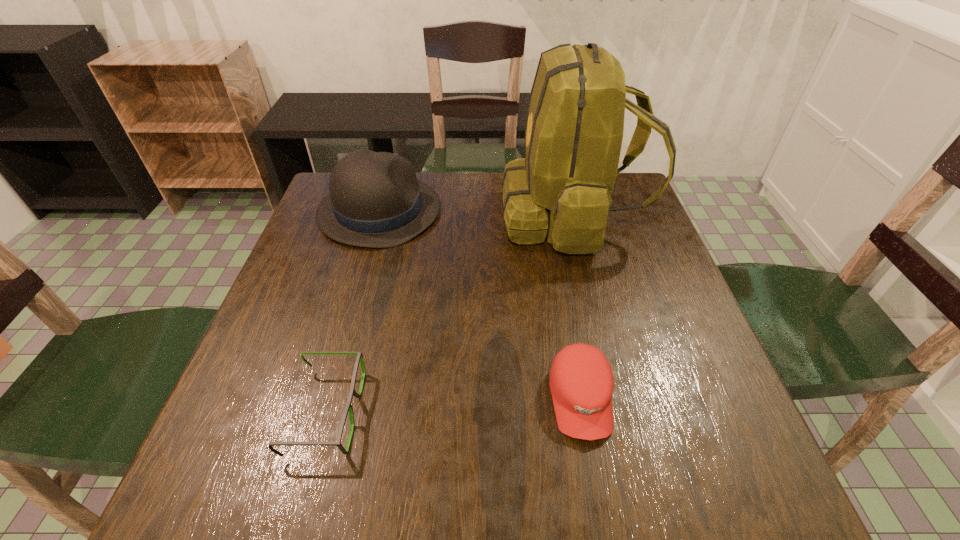
The image size is (960, 540). What are the coordinates of `unoccupied position between the spectacles and the second shortest object` in the screenshot? It's located at (453, 406).

The image size is (960, 540). What are the coordinates of `vacant point located between the tallest object and the spectacles` in the screenshot? It's located at (448, 314).

You are a GUI agent. You are given a task and a screenshot of the screen. Output one action in this format:
    pyautogui.click(x=<x>, y=<y>)
    Task: Click on the vacant space in between the bowler hat and the cap
    This screenshot has width=960, height=540.
    Given the screenshot: What is the action you would take?
    pyautogui.click(x=480, y=305)

Identify the location of vacant space that's between the bowler hat and the shortest object. (353, 311).

The width and height of the screenshot is (960, 540). Find the location of `vacant area that lies between the third tallest object and the second tallest object`. vacant area that lies between the third tallest object and the second tallest object is located at coordinates (480, 305).

This screenshot has width=960, height=540. Identify the location of the third closest object to the second tallest object. (581, 381).

Identify which object is located as the third nearest to the bowler hat. Please provide its 2D coordinates. Your answer should be formatted as a tuple, i.e. [(x, y)], where the tuple contains the x and y coordinates of a point satisfying the conditions above.

[(581, 381)]

The image size is (960, 540). In order to click on blank space that satisfies the following two spatial constraints: 1. on the front-facing side of the third tallest object; 2. on the lens of the shortest object in this screenshot , I will do `click(583, 412)`.

Image resolution: width=960 pixels, height=540 pixels. I want to click on blank area in the image that satisfies the following two spatial constraints: 1. on the front-facing side of the backpack; 2. on the front-facing side of the cap, so click(x=617, y=400).

This screenshot has height=540, width=960. I want to click on free location that satisfies the following two spatial constraints: 1. on the front-facing side of the tallest object; 2. on the front-facing side of the third tallest object, so click(x=617, y=400).